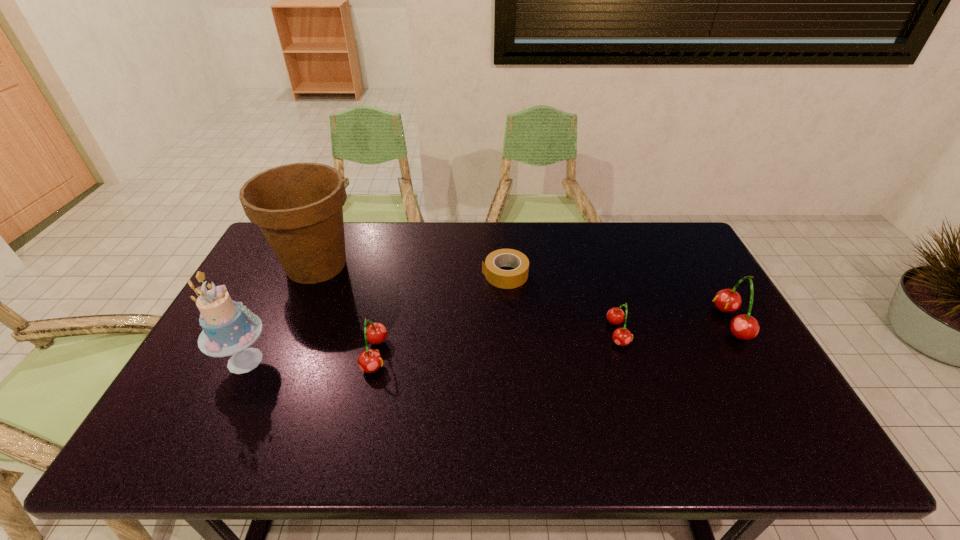
In order to click on unoccupied area between the flowerpot and the second cherry from right to left in this screenshot , I will do `click(468, 299)`.

In order to click on free space that is in between the rightmost cherry and the second object from right to left in this screenshot , I will do `click(674, 328)`.

Locate an element on the screen. free space between the third object from right to left and the second shortest cherry is located at coordinates (441, 315).

Locate an element on the screen. free space between the duct tape and the second tallest cherry is located at coordinates (441, 315).

You are a GUI agent. You are given a task and a screenshot of the screen. Output one action in this format:
    pyautogui.click(x=<x>, y=<y>)
    Task: Click on the free space between the shortest cherry and the rightmost cherry
    The width and height of the screenshot is (960, 540).
    Given the screenshot: What is the action you would take?
    pos(674,328)

Locate an element on the screen. free area in between the shortest cherry and the flowerpot is located at coordinates (468, 299).

You are a GUI agent. You are given a task and a screenshot of the screen. Output one action in this format:
    pyautogui.click(x=<x>, y=<y>)
    Task: Click on the empty space between the second cherry from right to left and the shortest object
    Image resolution: width=960 pixels, height=540 pixels.
    Given the screenshot: What is the action you would take?
    pyautogui.click(x=562, y=303)

Where is `unoccupied area between the fifth object from left to right and the rightmost object`? The width and height of the screenshot is (960, 540). unoccupied area between the fifth object from left to right and the rightmost object is located at coordinates (674, 328).

The height and width of the screenshot is (540, 960). What are the coordinates of `free space between the flowerpot and the cake` in the screenshot? It's located at (280, 313).

Find the location of `empty space that is in between the cake and the second shortest cherry`. empty space that is in between the cake and the second shortest cherry is located at coordinates (310, 357).